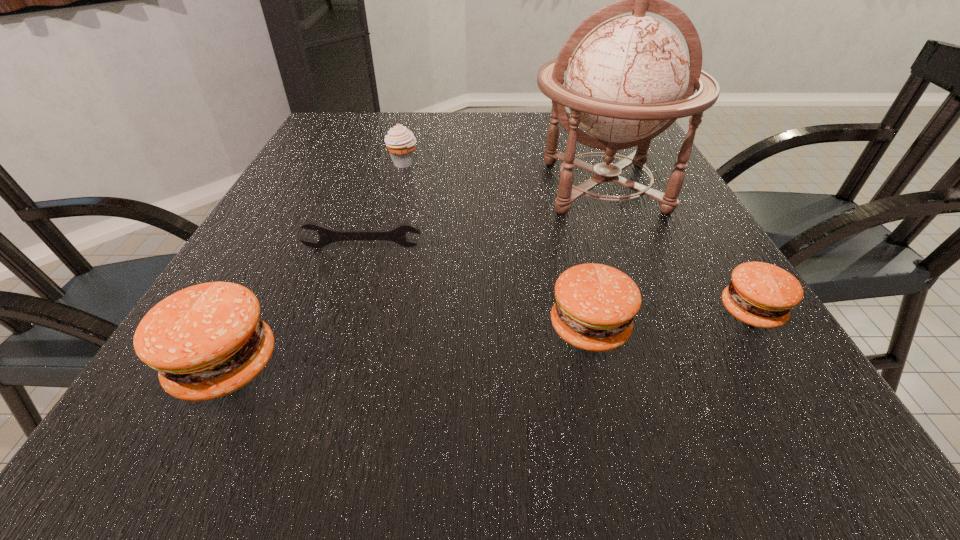
At what (x,y) coordinates should I click in order to perform the action: click on the tallest patty. Please return your answer as a coordinate pair (x, y). Looking at the image, I should click on (206, 341).

Find the location of a particular element. The width and height of the screenshot is (960, 540). the second shortest patty is located at coordinates (595, 304).

Where is `the shortest patty`? The image size is (960, 540). the shortest patty is located at coordinates click(x=762, y=295).

Identify the location of the fifth tallest object. This screenshot has height=540, width=960. 762,295.

Image resolution: width=960 pixels, height=540 pixels. I want to click on muffin, so click(x=400, y=141).

Identify the location of the shortest object. Image resolution: width=960 pixels, height=540 pixels. (327, 236).

At what (x,y) coordinates should I click in order to perform the action: click on the fourth nearest object. Please return your answer as a coordinate pair (x, y). This screenshot has width=960, height=540. Looking at the image, I should click on (327, 236).

Image resolution: width=960 pixels, height=540 pixels. Find the location of `the tallest object`. the tallest object is located at coordinates (629, 79).

The height and width of the screenshot is (540, 960). I want to click on vacant position located 0.390m on the right of the tallest patty, so click(544, 366).

Locate an element on the screen. The image size is (960, 540). vacant space situated on the left of the second patty from left to right is located at coordinates (448, 328).